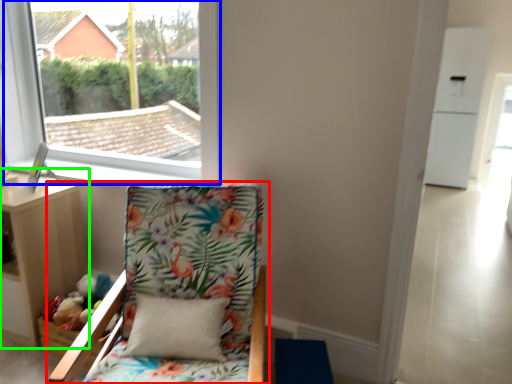
Question: Based on their relative distances, which object is farther from chair (highlighted by a red box)? Choose from window (highlighted by a blue box) and nightstand (highlighted by a green box).

Choices:
 (A) window
 (B) nightstand

Answer: (A)